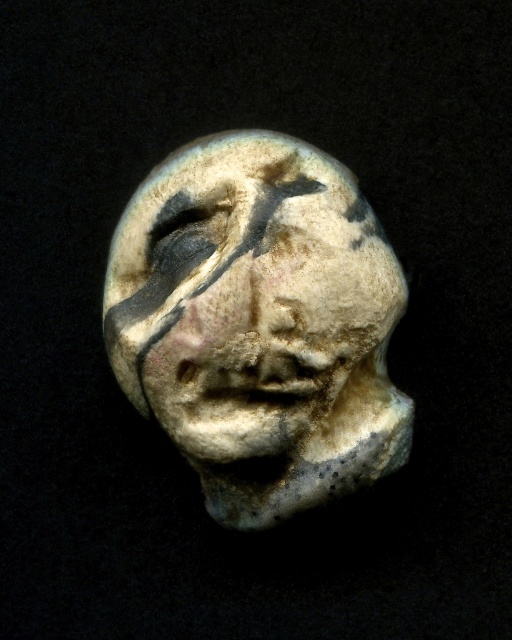
You are an archaeologist examining the sculpture. You notice a specific point on the sculpture at coordinates point (251,300). What object is located at that point?

The speckled clay face at center is located at point (251,300).